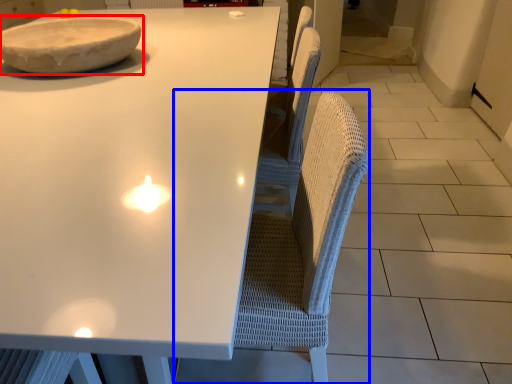
Question: Which point is closer to the camera, bowl (highlighted by a red box) or swivel chair (highlighted by a blue box)?

Choices:
 (A) bowl
 (B) swivel chair

Answer: (B)